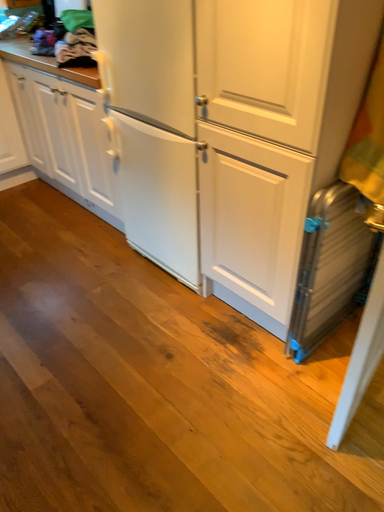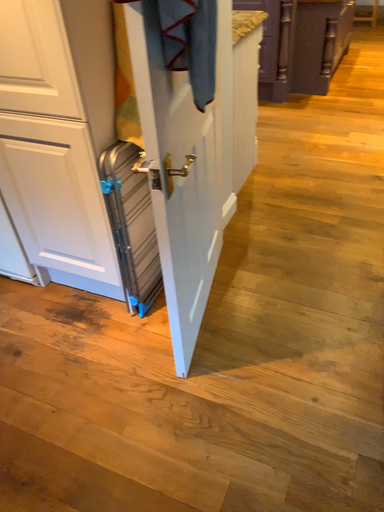
Question: Which way did the camera rotate in the video?

Choices:
 (A) rotated right
 (B) rotated left

Answer: (A)